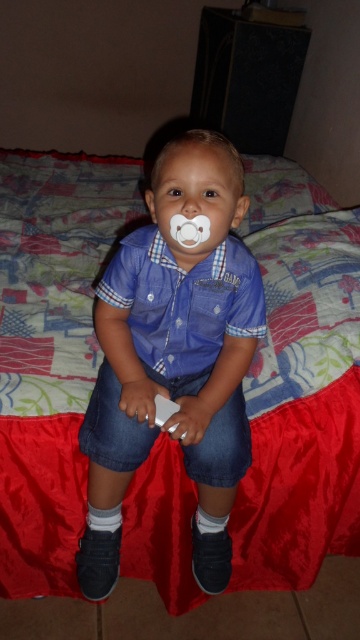
Does blue denim shorts at center appear under blue plaid shirt at center?

Indeed, blue denim shorts at center is positioned under blue plaid shirt at center.

Is point (118, 531) positioned after point (240, 291)?

Yes, it is behind point (240, 291).

Find the location of a particular element. blue denim shorts at center is located at coordinates (174, 356).

Which is more to the right, blue plaid shirt at center or white plastic wii controller at center?

blue plaid shirt at center

Is the position of blue plaid shirt at center less distant than that of white plastic wii controller at center?

Yes, blue plaid shirt at center is closer to the viewer.

At what (x,y) coordinates should I click in order to perform the action: click on blue plaid shirt at center. Please return your answer as a coordinate pair (x, y). Looking at the image, I should click on pyautogui.click(x=182, y=300).

The width and height of the screenshot is (360, 640). Find the location of `blue plaid shirt at center`. blue plaid shirt at center is located at coordinates (182, 300).

Which is behind, point (198, 288) or point (160, 424)?

Point (198, 288)

Between point (182, 209) and point (155, 412), which one is positioned in front?

Point (182, 209) is in front.

At what (x,y) coordinates should I click in order to perform the action: click on blue denim shorts at center. Please return your answer as a coordinate pair (x, y). Looking at the image, I should click on (174, 356).